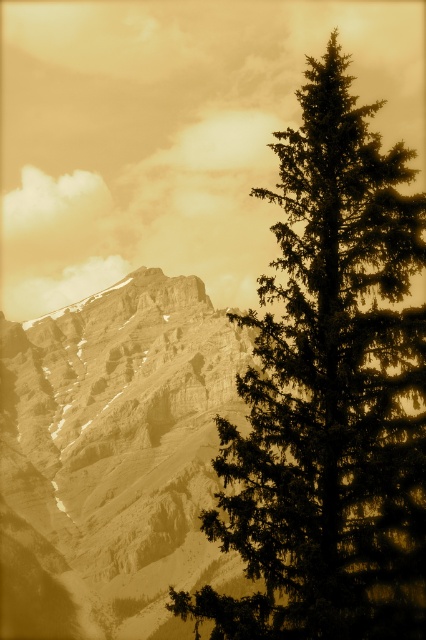
Question: Which point is closer to the camera taking this photo?

Choices:
 (A) (328, 234)
 (B) (83, 330)

Answer: (A)

Question: Among these objects, which one is nearest to the camera?

Choices:
 (A) green textured pine tree at right
 (B) sepia textured mountain range at left

Answer: (A)

Question: Can you confirm if green textured pine tree at right is wider than sepia textured mountain range at left?

Choices:
 (A) yes
 (B) no

Answer: (B)

Question: Does green textured pine tree at right appear on the right side of sepia textured mountain range at left?

Choices:
 (A) no
 (B) yes

Answer: (B)

Question: Is green textured pine tree at right wider than sepia textured mountain range at left?

Choices:
 (A) no
 (B) yes

Answer: (A)

Question: Which point appears farthest from the camera in this image?

Choices:
 (A) (150, 634)
 (B) (385, 385)

Answer: (A)